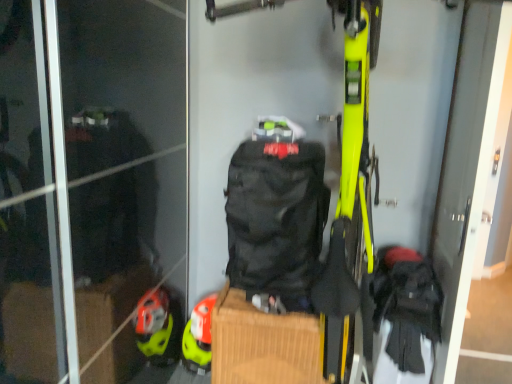
What do you see at coordinates (199, 337) in the screenshot? I see `matte yellow helmet at lower left` at bounding box center [199, 337].

Where is `black fabric screen door at right`? black fabric screen door at right is located at coordinates (467, 166).

Based on the photo, is matte yellow helmet at lower left facing towards black fabric backpack at center?

No, matte yellow helmet at lower left does not turn towards black fabric backpack at center.

How different are the orientations of matte yellow helmet at lower left and black fabric backpack at center in degrees?

matte yellow helmet at lower left and black fabric backpack at center are facing 1.94 degrees away from each other.

Is matte yellow helmet at lower left far from black fabric backpack at center?

matte yellow helmet at lower left is actually quite close to black fabric backpack at center.

This screenshot has width=512, height=384. What are the coordinates of `footwear to the left of black fabric backpack at center` in the screenshot? It's located at (199, 337).

Is matte yellow helmet at lower left at the back of black fabric backpack at center?

No, black fabric backpack at center's orientation is not away from matte yellow helmet at lower left.

In the scene shown: Does black fabric backpack at center have a greater width compared to matte yellow helmet at lower left?

Yes, black fabric backpack at center is wider than matte yellow helmet at lower left.

Is black fabric backpack at center inside the boundaries of matte yellow helmet at lower left, or outside?

black fabric backpack at center lies outside matte yellow helmet at lower left.

Which of these two, black fabric backpack at center or black fabric screen door at right, stands taller?

With more height is black fabric screen door at right.

Is point (273, 235) positioned behind point (485, 95)?

Yes, point (273, 235) is behind point (485, 95).

The width and height of the screenshot is (512, 384). What are the coordinates of `screen door that is above the black fabric backpack at center (from a real-world perspective)` in the screenshot? It's located at (467, 166).

Which object is more forward, black fabric backpack at center or black fabric screen door at right?

black fabric screen door at right is more forward.

Between matte yellow helmet at lower left and black fabric screen door at right, which one appears on the right side from the viewer's perspective?

From the viewer's perspective, black fabric screen door at right appears more on the right side.

From a real-world perspective, is matte yellow helmet at lower left above or below black fabric screen door at right?

From a real-world perspective, matte yellow helmet at lower left is physically below black fabric screen door at right.

Can you confirm if black fabric screen door at right is positioned to the left of black fabric backpack at center?

No, black fabric screen door at right is not to the left of black fabric backpack at center.

Is black fabric screen door at right inside the boundaries of black fabric backpack at center, or outside?

black fabric screen door at right is not inside black fabric backpack at center, it's outside.

Which of these two, black fabric screen door at right or black fabric backpack at center, is smaller?

black fabric backpack at center is smaller.

How many degrees apart are the facing directions of black fabric screen door at right and black fabric backpack at center?

85.2 degrees separate the facing orientations of black fabric screen door at right and black fabric backpack at center.

At what (x,y) coordinates should I click in order to perform the action: click on footwear located underneath the black fabric screen door at right (from a real-world perspective). Please return your answer as a coordinate pair (x, y). Image resolution: width=512 pixels, height=384 pixels. Looking at the image, I should click on (199, 337).

Considering the relative positions of black fabric screen door at right and matte yellow helmet at lower left in the image provided, is black fabric screen door at right to the left or to the right of matte yellow helmet at lower left?

From the image, it's evident that black fabric screen door at right is to the right of matte yellow helmet at lower left.

Can you see black fabric screen door at right touching matte yellow helmet at lower left?

No, black fabric screen door at right is not beside matte yellow helmet at lower left.

What are the coordinates of `footwear lying behind the black fabric backpack at center` in the screenshot? It's located at (199, 337).

Find the location of a particular element. Image resolution: width=512 pixels, height=384 pixels. backpack positioned vertically above the matte yellow helmet at lower left (from a real-world perspective) is located at coordinates (276, 219).

Based on their spatial positions, is matte yellow helmet at lower left or black fabric backpack at center further from black fabric screen door at right?

Based on the image, matte yellow helmet at lower left appears to be further to black fabric screen door at right.

Looking at the image, which one is located closer to black fabric backpack at center, matte yellow helmet at lower left or black fabric screen door at right?

matte yellow helmet at lower left lies closer to black fabric backpack at center than the other object.

Looking at this image, considering their positions, is black fabric backpack at center positioned closer to black fabric screen door at right than matte yellow helmet at lower left?

The object closer to black fabric screen door at right is black fabric backpack at center.

Based on their spatial positions, is black fabric screen door at right or matte yellow helmet at lower left further from black fabric backpack at center?

Based on the image, black fabric screen door at right appears to be further to black fabric backpack at center.

Estimate the real-world distances between objects in this image. Which object is further from matte yellow helmet at lower left, black fabric screen door at right or black fabric backpack at center?

black fabric screen door at right.

When comparing their distances from matte yellow helmet at lower left, does black fabric backpack at center or black fabric screen door at right seem closer?

black fabric backpack at center lies closer to matte yellow helmet at lower left than the other object.

The height and width of the screenshot is (384, 512). What are the coordinates of `backpack between matte yellow helmet at lower left and black fabric screen door at right in the horizontal direction` in the screenshot? It's located at (276, 219).